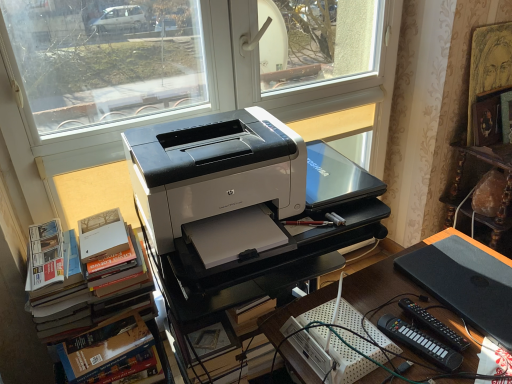
What are the coordinates of `empty space that is ontop of black matte laptop at lower right (from a real-world perspective)` in the screenshot? It's located at (472, 293).